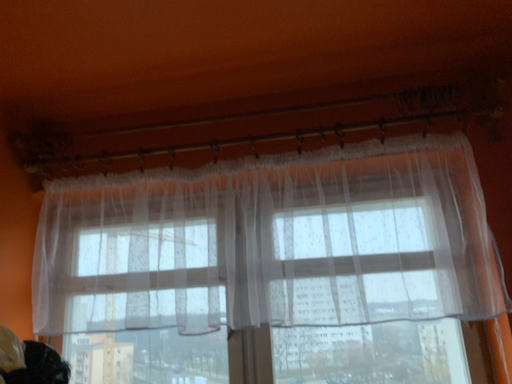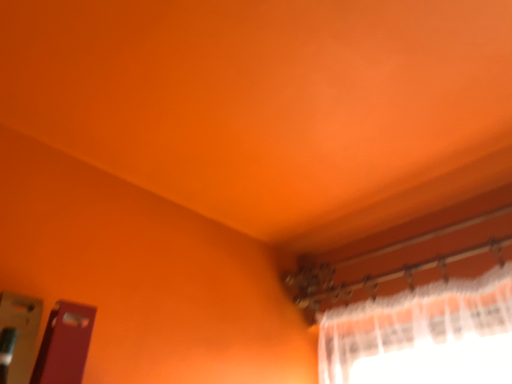
Question: How did the camera likely rotate when shooting the video?

Choices:
 (A) rotated downward
 (B) rotated upward

Answer: (B)